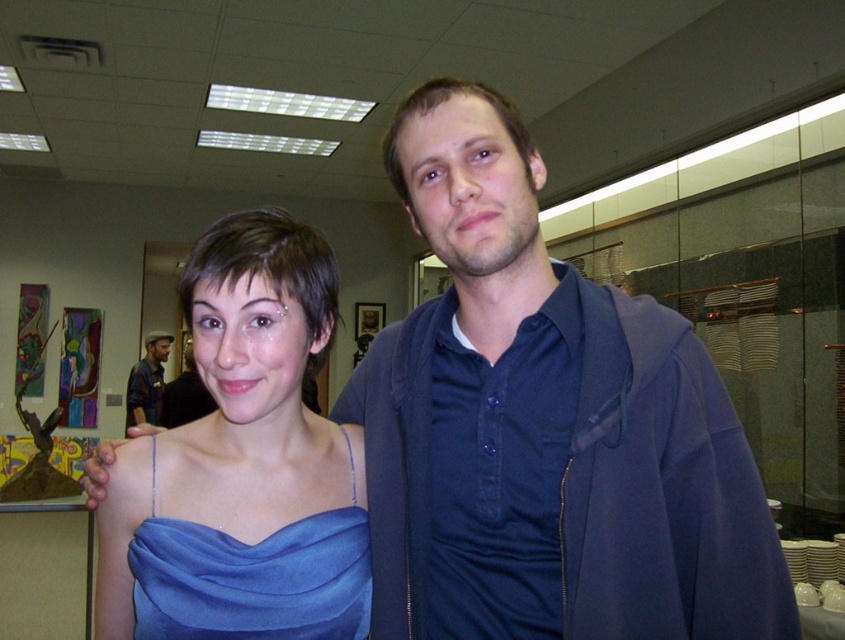
Question: Which is farther from the plaid shirt at left?

Choices:
 (A) satin blue dress at center
 (B) matte blue dress at center

Answer: (A)

Question: Is satin blue dress at center wider than plaid shirt at left?

Choices:
 (A) yes
 (B) no

Answer: (B)

Question: Among these objects, which one is nearest to the camera?

Choices:
 (A) satin blue dress at center
 (B) plaid shirt at left
 (C) matte blue dress at center

Answer: (C)

Question: Which point appears farthest from the camera in this image?

Choices:
 (A) (115, 620)
 (B) (126, 403)

Answer: (B)

Question: Does matte blue dress at center appear over plaid shirt at left?

Choices:
 (A) no
 (B) yes

Answer: (B)

Question: Is the position of satin blue dress at center more distant than that of plaid shirt at left?

Choices:
 (A) no
 (B) yes

Answer: (A)